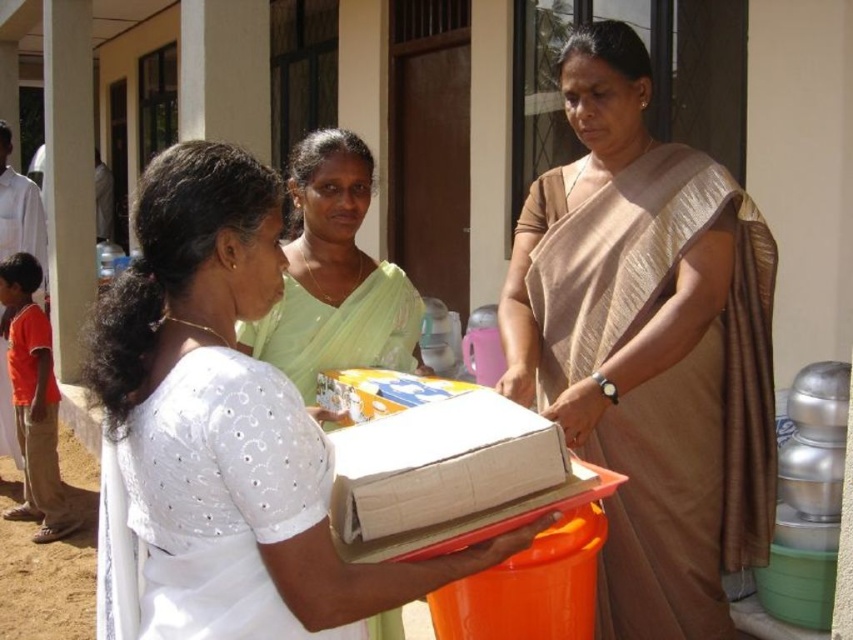
Question: Which is nearer to the white lace blouse at center?

Choices:
 (A) matte gold sari at center
 (B) light green silk saree at center

Answer: (B)

Question: Does matte gold sari at center appear on the left side of light green silk saree at center?

Choices:
 (A) yes
 (B) no

Answer: (B)

Question: Among these points, which one is farthest from the camera?

Choices:
 (A) (688, 305)
 (B) (196, 452)
 (C) (369, 152)

Answer: (C)

Question: Which object is farther from the camera taking this photo?

Choices:
 (A) white lace blouse at center
 (B) matte gold sari at center
 (C) light green silk saree at center

Answer: (C)

Question: Does matte gold sari at center appear on the right side of light green silk saree at center?

Choices:
 (A) yes
 (B) no

Answer: (A)

Question: Does matte gold sari at center appear over light green silk saree at center?

Choices:
 (A) no
 (B) yes

Answer: (A)